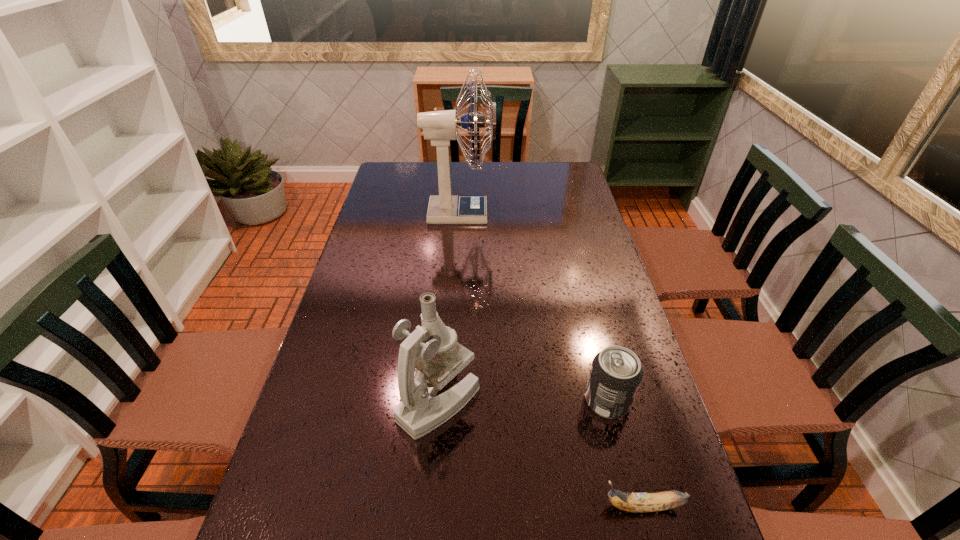
Point out which object is positioned as the nearest to the second shortest object. Please provide its 2D coordinates. Your answer should be formatted as a tuple, i.e. [(x, y)], where the tuple contains the x and y coordinates of a point satisfying the conditions above.

[(631, 502)]

Select which object is the second closest to the third shortest object. Please provide its 2D coordinates. Your answer should be formatted as a tuple, i.e. [(x, y)], where the tuple contains the x and y coordinates of a point satisfying the conditions above.

[(631, 502)]

I want to click on blank area in the image that satisfies the following two spatial constraints: 1. on the front-facing side of the farthest object; 2. on the back side of the third tallest object, so click(448, 401).

The width and height of the screenshot is (960, 540). Identify the location of vacant area in the image that satisfies the following two spatial constraints: 1. on the front-facing side of the tallest object; 2. on the front side of the second tallest object. (448, 400).